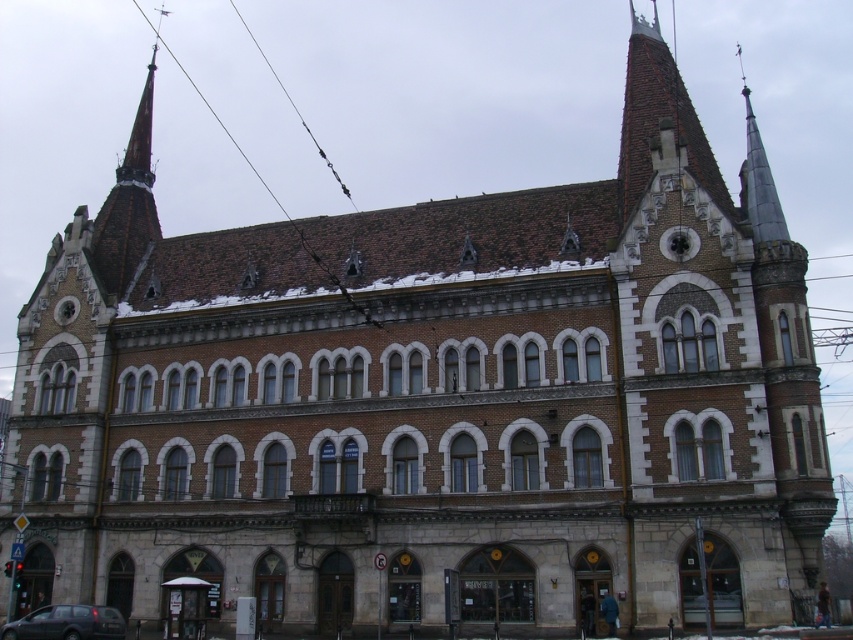
Question: Which of the following is the farthest from the observer?

Choices:
 (A) brown wire at upper center
 (B) dark gray metallic van at lower left

Answer: (A)

Question: Can you confirm if dark gray metallic van at lower left is smaller than brown wire at upper center?

Choices:
 (A) yes
 (B) no

Answer: (A)

Question: Does dark gray metallic van at lower left have a smaller size compared to brown wire at upper center?

Choices:
 (A) no
 (B) yes

Answer: (B)

Question: Does dark gray metallic van at lower left appear over brown wire at upper center?

Choices:
 (A) no
 (B) yes

Answer: (A)

Question: Which point appears closest to the camera in this image?

Choices:
 (A) click(x=12, y=627)
 (B) click(x=276, y=200)

Answer: (A)